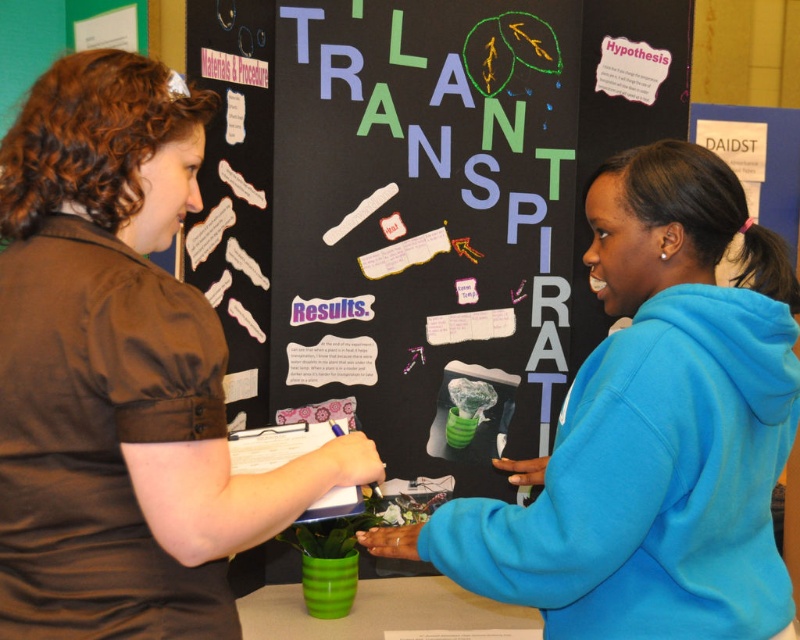
You are a photographer at the science fair and want to ensure both participants are clearly visible in the photo. Given the positions of the brown fabric shirt at upper left and the blue fleece sweatshirt at right, which participant should you focus on first to capture their full body in the frame?

You should focus on the blue fleece sweatshirt at right first because it occupies more space in the frame than the brown fabric shirt at upper left, ensuring their full body is captured before adjusting for the other participant.

You are standing at the origin point in the image. You want to move to the point labeled as point (574, 547). Is the other point, point (316, 104), located behind your target point?

Yes, point (316, 104) is behind point (574, 547), so it would not be visible from your current position facing the target point.